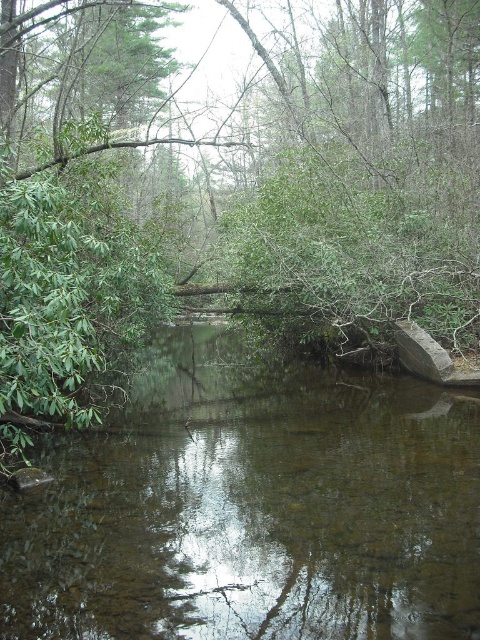
Between green leafy tree at center and brown reflective water at center, which one appears on the left side from the viewer's perspective?

brown reflective water at center

Is the position of green leafy tree at center less distant than that of brown reflective water at center?

No, it is not.

Describe the element at coordinates (230, 189) in the screenshot. This screenshot has height=640, width=480. I see `green leafy tree at center` at that location.

The image size is (480, 640). I want to click on green leafy tree at center, so click(x=230, y=189).